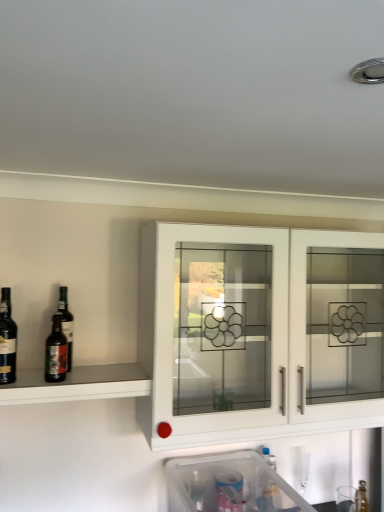
You are a GUI agent. You are given a task and a screenshot of the screen. Output one action in this format:
    pyautogui.click(x=<x>, y=<y>)
    Task: Click on the blank space to the left of dark brown glass bottle at left, which is the second wine from left to right
    The height and width of the screenshot is (512, 384).
    Given the screenshot: What is the action you would take?
    pyautogui.click(x=24, y=380)